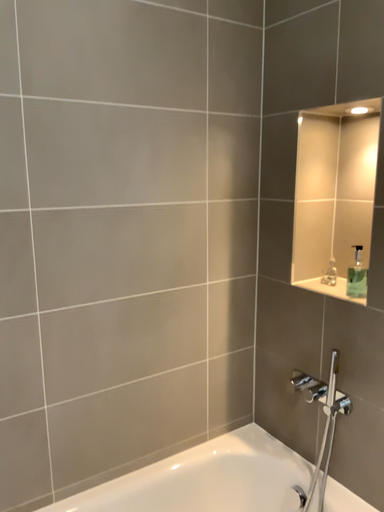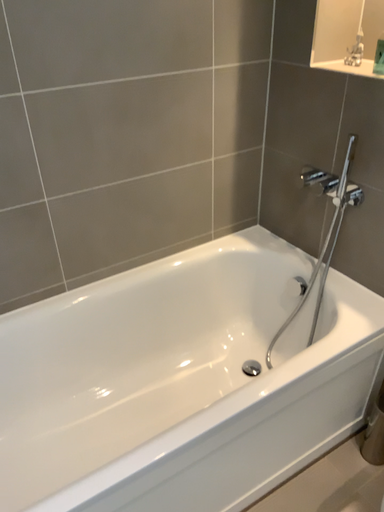
Question: How did the camera likely rotate when shooting the video?

Choices:
 (A) rotated downward
 (B) rotated upward

Answer: (A)